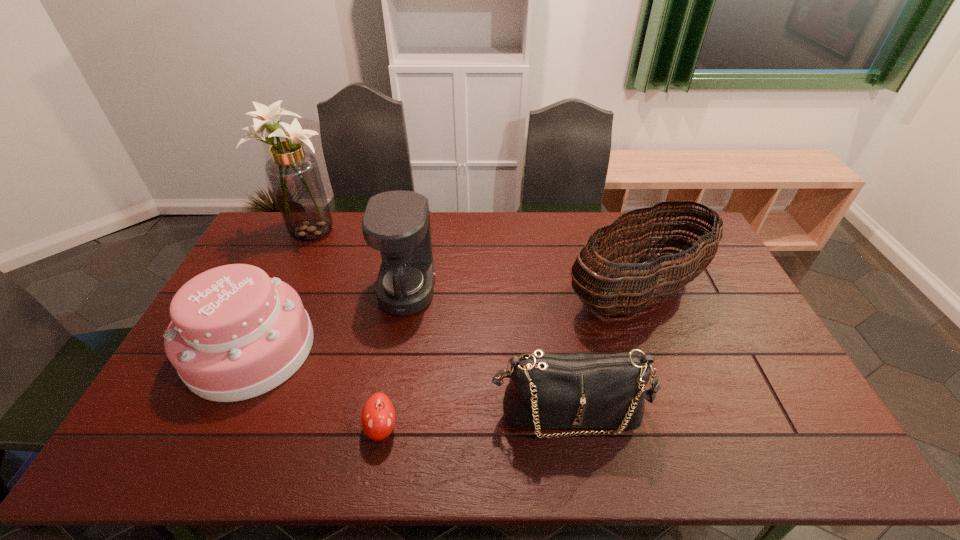
Where is `vacant space located on the back of the birthday cake`? vacant space located on the back of the birthday cake is located at coordinates (296, 254).

You are a GUI agent. You are given a task and a screenshot of the screen. Output one action in this format:
    pyautogui.click(x=<x>, y=<y>)
    Task: Click on the free space located on the back of the apple
    The height and width of the screenshot is (540, 960).
    Given the screenshot: What is the action you would take?
    pyautogui.click(x=395, y=351)

Locate an element on the screen. The image size is (960, 540). object present at the far edge is located at coordinates (293, 173).

You are a GUI agent. You are given a task and a screenshot of the screen. Output one action in this format:
    pyautogui.click(x=<x>, y=<y>)
    Task: Click on the handbag present at the near edge
    This screenshot has width=960, height=540.
    Given the screenshot: What is the action you would take?
    pos(577,390)

Where is `apple located at the near edge`? The image size is (960, 540). apple located at the near edge is located at coordinates (378, 415).

At what (x,y) coordinates should I click in order to perform the action: click on flower arrangement located in the left edge section of the desktop. Please return your answer as a coordinate pair (x, y). Looking at the image, I should click on (293, 173).

Where is `birthday cake at the left edge`? birthday cake at the left edge is located at coordinates (235, 333).

I want to click on object present at the right edge, so click(627, 292).

The image size is (960, 540). What are the coordinates of `object at the far left corner` in the screenshot? It's located at click(293, 173).

Locate an element on the screen. vacant region at the far edge is located at coordinates (540, 213).